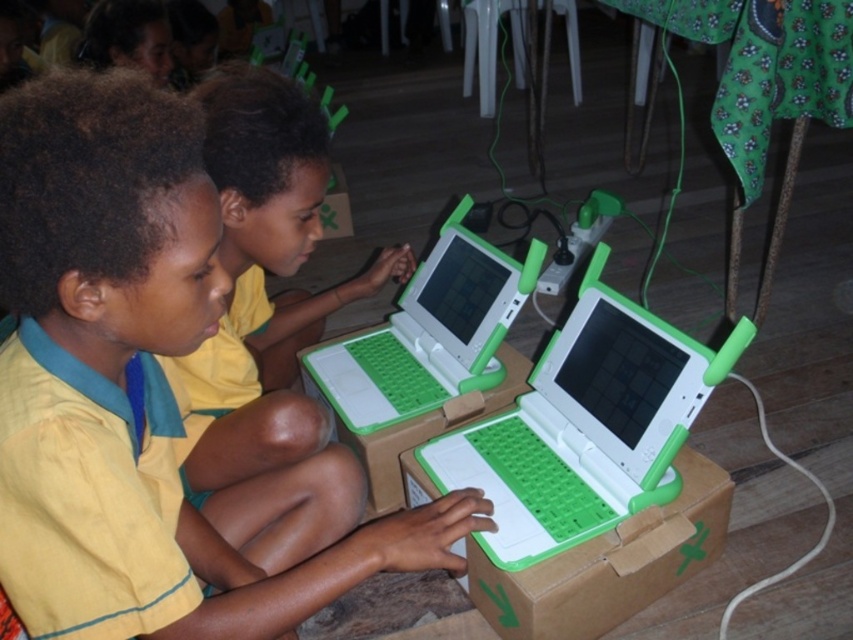
Is yellow shirt at center to the left of white plastic laptop at center from the viewer's perspective?

Yes, yellow shirt at center is to the left of white plastic laptop at center.

Is point (257, 532) positioned before point (727, 349)?

That is False.

Is point (239, 422) farther from viewer compared to point (718, 362)?

Yes, it is behind point (718, 362).

Where is `yellow shirt at center`? The width and height of the screenshot is (853, 640). yellow shirt at center is located at coordinates (270, 330).

Is point (541, 419) less distant than point (460, 236)?

Yes, it is in front of point (460, 236).

Does white plastic laptop at center have a larger size compared to green plastic laptop at center?

Correct, white plastic laptop at center is larger in size than green plastic laptop at center.

Identify the location of white plastic laptop at center. The width and height of the screenshot is (853, 640). (585, 426).

Is point (166, 336) farther from viewer compared to point (238, 413)?

No, it is in front of (238, 413).

Based on the photo, can you confirm if yellow fabric shirt at center is positioned below yellow shirt at center?

Yes, yellow fabric shirt at center is below yellow shirt at center.

Between point (216, 614) and point (212, 368), which one is positioned in front?

Point (216, 614) is more forward.

What are the coordinates of `yellow fabric shirt at center` in the screenshot? It's located at (108, 227).